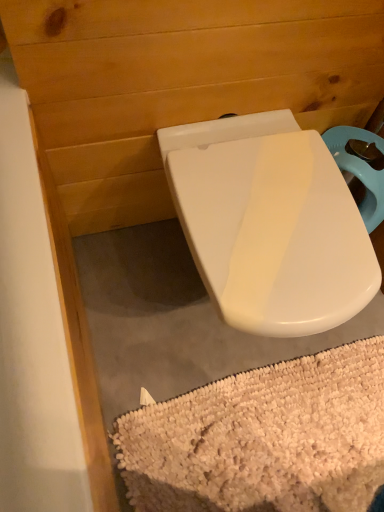
Question: Considering the positions of white glossy toilet seat at center and white shaggy bath mat at lower center in the image, is white glossy toilet seat at center taller or shorter than white shaggy bath mat at lower center?

Choices:
 (A) short
 (B) tall

Answer: (B)

Question: From the image's perspective, relative to white shaggy bath mat at lower center, is white glossy toilet seat at center above or below?

Choices:
 (A) below
 (B) above

Answer: (B)

Question: Is white glossy toilet seat at center situated inside white shaggy bath mat at lower center or outside?

Choices:
 (A) outside
 (B) inside

Answer: (A)

Question: From a real-world perspective, is white shaggy bath mat at lower center physically located above or below white glossy toilet seat at center?

Choices:
 (A) above
 (B) below

Answer: (B)

Question: In the image, is white shaggy bath mat at lower center positioned in front of or behind white glossy toilet seat at center?

Choices:
 (A) behind
 (B) front

Answer: (A)

Question: In the image, is white shaggy bath mat at lower center on the left side or the right side of white glossy toilet seat at center?

Choices:
 (A) right
 (B) left

Answer: (A)

Question: Considering the positions of white shaggy bath mat at lower center and white glossy toilet seat at center in the image, is white shaggy bath mat at lower center bigger or smaller than white glossy toilet seat at center?

Choices:
 (A) small
 (B) big

Answer: (A)